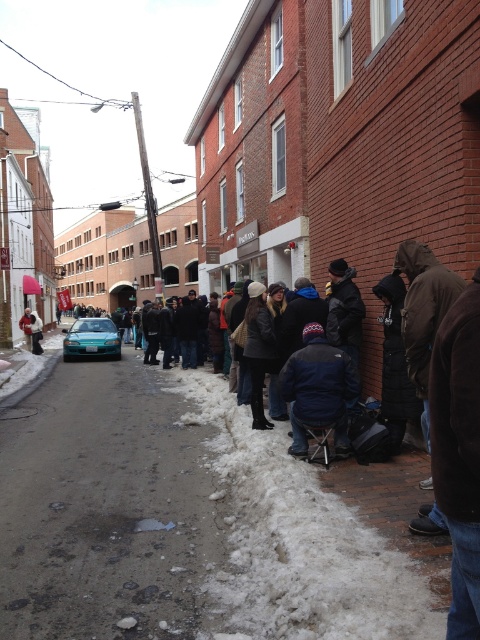
Based on the photo, does porous asphalt road at lower center have a smaller size compared to teal matte car at lower left?

Indeed, porous asphalt road at lower center has a smaller size compared to teal matte car at lower left.

The height and width of the screenshot is (640, 480). What do you see at coordinates (105, 508) in the screenshot? I see `porous asphalt road at lower center` at bounding box center [105, 508].

Where is `porous asphalt road at lower center`? Image resolution: width=480 pixels, height=640 pixels. porous asphalt road at lower center is located at coordinates (105, 508).

Can you confirm if dark blue fleece jacket at center is positioned below white wool coat at lower left?

Yes.

Is point (299, 442) positioned after point (26, 316)?

No.

Who is more distant from viewer, (302, 433) or (34, 314)?

Positioned behind is point (34, 314).

What are the coordinates of `dark blue fleece jacket at center` in the screenshot? It's located at (317, 388).

Who is positioned more to the right, teal matte car at lower left or white wool coat at lower left?

teal matte car at lower left is more to the right.

Can you confirm if teal matte car at lower left is positioned below white wool coat at lower left?

Yes.

What do you see at coordinates (91, 339) in the screenshot? I see `teal matte car at lower left` at bounding box center [91, 339].

Locate an element on the screen. This screenshot has height=640, width=480. teal matte car at lower left is located at coordinates (91, 339).